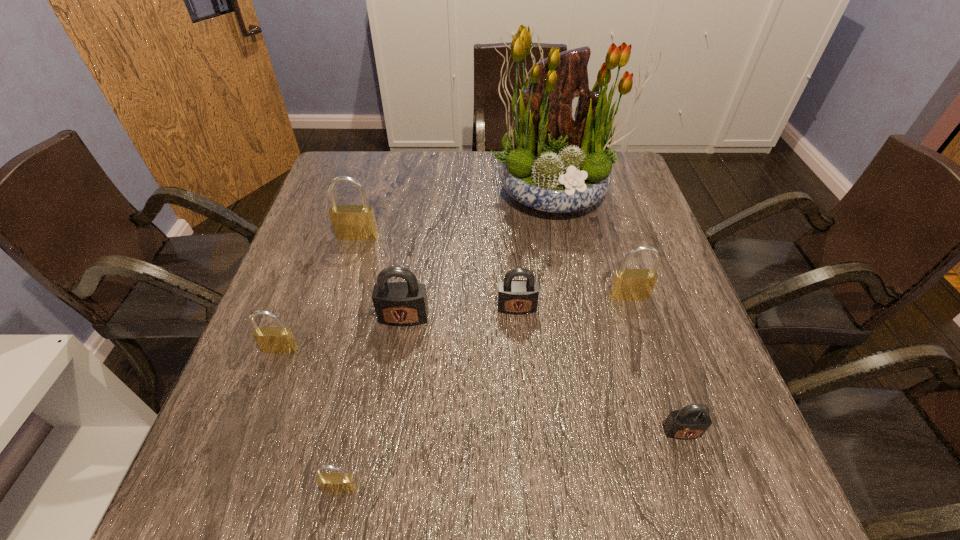
This screenshot has height=540, width=960. Find the location of `the tallest object`. the tallest object is located at coordinates (555, 162).

What are the coordinates of `flower arrangement` in the screenshot? It's located at (555, 162).

Where is `the second object from left to right`? Image resolution: width=960 pixels, height=540 pixels. the second object from left to right is located at coordinates (350, 222).

The width and height of the screenshot is (960, 540). I want to click on the tallest padlock, so click(350, 222).

Identify the location of the third nearest brass padlock. This screenshot has width=960, height=540. (628, 284).

Identify the location of the rightmost brass padlock. (628, 284).

Locate an element on the screen. the leftmost gray padlock is located at coordinates (402, 304).

The height and width of the screenshot is (540, 960). I want to click on the fifth padlock from left to right, so click(x=517, y=297).

This screenshot has width=960, height=540. Find the location of `the second gray padlock from right to left`. the second gray padlock from right to left is located at coordinates (517, 297).

At what (x,y) coordinates should I click in order to perform the action: click on the leftmost padlock. Please return your answer as a coordinate pair (x, y). Looking at the image, I should click on (279, 339).